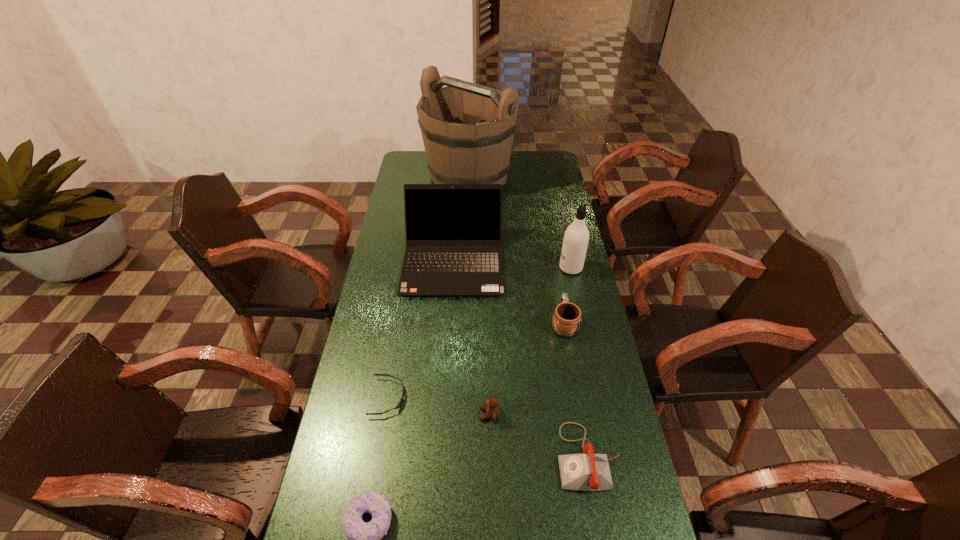
The width and height of the screenshot is (960, 540). Identify the location of object that is at the far left corner. (467, 129).

You are a GUI agent. You are given a task and a screenshot of the screen. Output one action in this format:
    pyautogui.click(x=<x>, y=<y>)
    Task: Click on the blank space at the left edge
    
    Given the screenshot: What is the action you would take?
    pyautogui.click(x=359, y=392)

Where is `vacant region at the right edge of the desktop`? The height and width of the screenshot is (540, 960). vacant region at the right edge of the desktop is located at coordinates (629, 478).

Where is `free space at the far right corner of the desktop`? The width and height of the screenshot is (960, 540). free space at the far right corner of the desktop is located at coordinates (528, 158).

The width and height of the screenshot is (960, 540). I want to click on vacant region between the teddy bear and the shortest object, so click(x=439, y=406).

Locate an element on the screen. free point between the mug and the shortest object is located at coordinates (476, 360).

At what (x,y) coordinates should I click in order to perform the action: click on vacant space that's between the bucket and the fourth farthest object. Please return your answer as a coordinate pair (x, y). The height and width of the screenshot is (540, 960). Looking at the image, I should click on (516, 249).

In order to click on free spot between the telephone and the sunglasses in this screenshot , I will do `click(488, 427)`.

The width and height of the screenshot is (960, 540). In order to click on unoccupied position between the seventh shortest object and the telephone in this screenshot , I will do `click(580, 362)`.

The width and height of the screenshot is (960, 540). In order to click on unoccupied position between the shortest object and the teddy bear in this screenshot , I will do `click(439, 406)`.